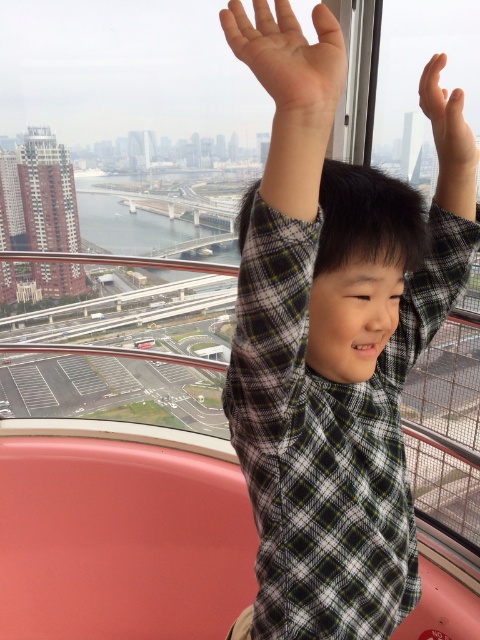
Question: Which of these objects is positioned farthest from the plaid fabric arm at upper right?

Choices:
 (A) pale skin palm at upper center
 (B) plaid shirt at center
 (C) matte skin hand at upper right

Answer: (B)

Question: Estimate the real-world distances between objects in this image. Which object is closer to the pale skin palm at upper center?

Choices:
 (A) plaid fabric arm at upper right
 (B) plaid shirt at center
 (C) matte skin hand at upper right

Answer: (B)

Question: Does plaid fabric arm at upper right appear on the left side of matte skin hand at upper right?

Choices:
 (A) no
 (B) yes

Answer: (B)

Question: Does pale skin palm at upper center lie behind matte skin hand at upper right?

Choices:
 (A) yes
 (B) no

Answer: (B)

Question: Which object appears closest to the camera in this image?

Choices:
 (A) matte skin hand at upper right
 (B) plaid fabric arm at upper right
 (C) pale skin palm at upper center

Answer: (C)

Question: Considering the relative positions of pale skin palm at upper center and matte skin hand at upper right in the image provided, where is pale skin palm at upper center located with respect to matte skin hand at upper right?

Choices:
 (A) left
 (B) right

Answer: (A)